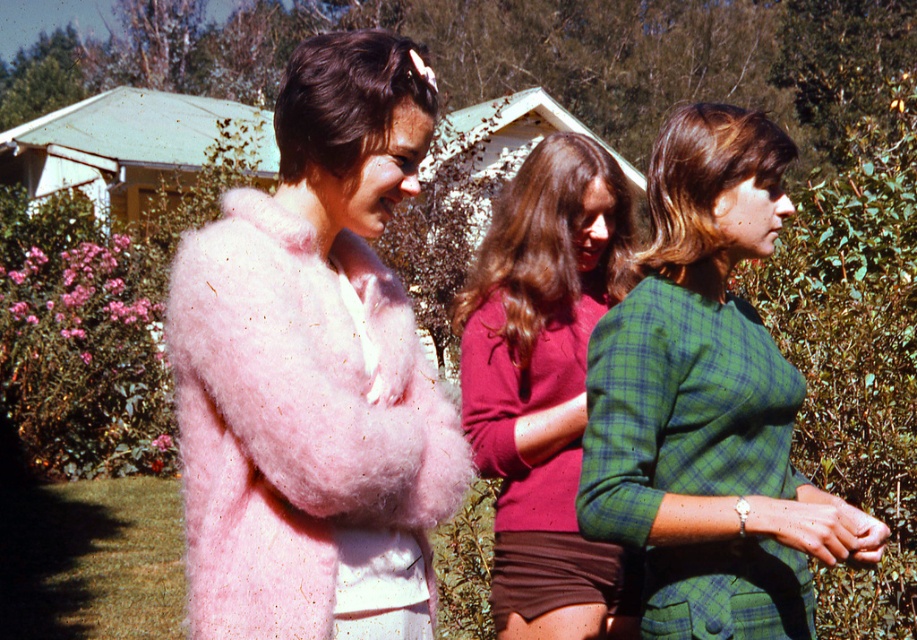
You are a photographer trying to capture a group photo of the three people. You notice the green plaid dress at right and the plaid fabric shirt at center. Which clothing item should you adjust to ensure both are fully visible in the frame?

The green plaid dress at right has a lesser height compared to plaid fabric shirt at center. To ensure both are fully visible, you should adjust the plaid fabric shirt at center to a lower position so it doesn t block the view of the shorter green plaid dress at right.

You are a fashion designer observing three people in a garden. You need to determine which clothing item is taller between the pink fluffy coat at left and the plaid fabric shirt at center. Which one is taller?

The pink fluffy coat at left is taller than the plaid fabric shirt at center.